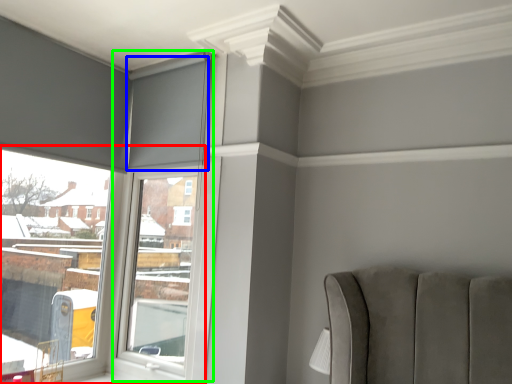
Question: Which object is the closest to the window (highlighted by a red box)? Choose among these: curtain (highlighted by a blue box) or window frame (highlighted by a green box).

Choices:
 (A) curtain
 (B) window frame

Answer: (B)